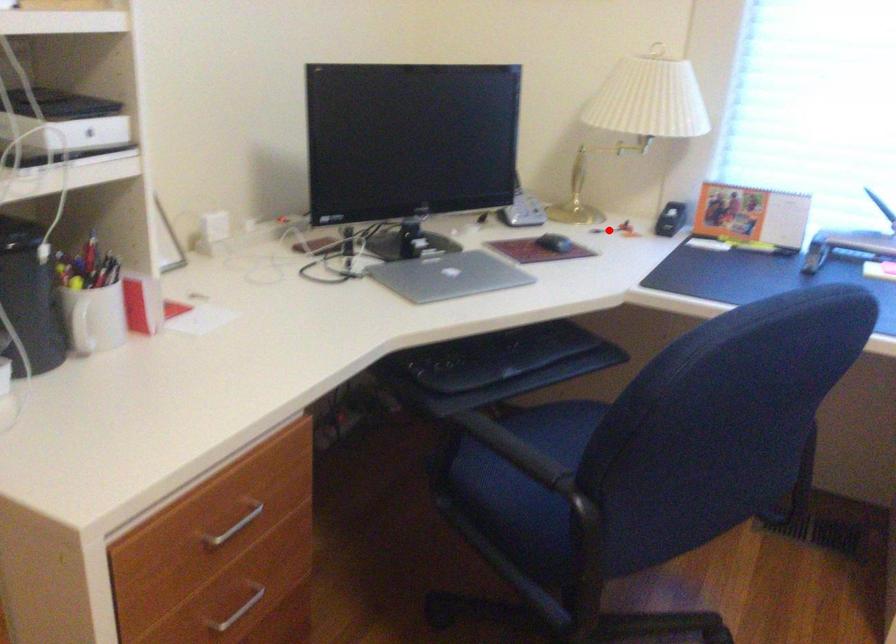
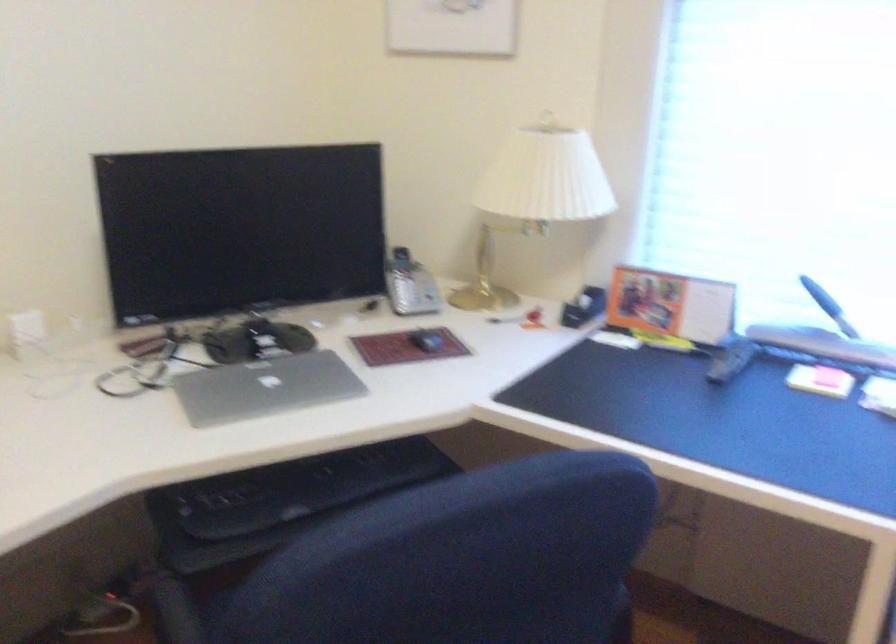
Question: I am providing you with two images of the same scene from different viewpoints. A red point is shown in image1. For the corresponding object point in image2, is it positioned nearer or farther from the camera?

Choices:
 (A) Nearer
 (B) Farther

Answer: (A)